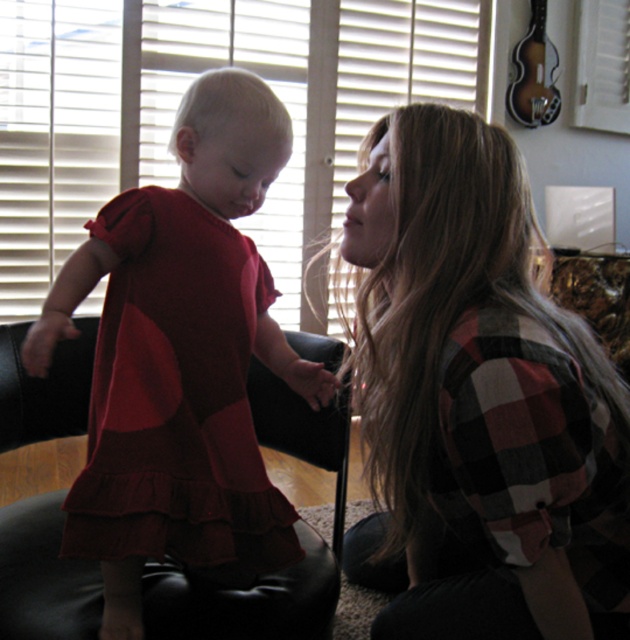
The image size is (630, 640). What do you see at coordinates (476, 401) in the screenshot?
I see `plaid flannel shirt at center` at bounding box center [476, 401].

Which is behind, point (420, 376) or point (135, 365)?

The point (135, 365) is more distant.

The height and width of the screenshot is (640, 630). Identify the location of plaid flannel shirt at center. 476,401.

Between plaid flannel shirt at center and white matte blinds at upper center, which one has less height?

With less height is plaid flannel shirt at center.

Does point (541, 554) lie behind point (37, 236)?

No, it is in front of (37, 236).

This screenshot has height=640, width=630. Describe the element at coordinates (476, 401) in the screenshot. I see `plaid flannel shirt at center` at that location.

This screenshot has width=630, height=640. What are the coordinates of `plaid flannel shirt at center` in the screenshot? It's located at (476, 401).

Who is higher up, matte red dress at left or white matte blinds at upper center?

Positioned higher is white matte blinds at upper center.

Which of these two, matte red dress at left or white matte blinds at upper center, stands taller?

With more height is white matte blinds at upper center.

Which is in front, point (239, 372) or point (321, 150)?

Point (239, 372) is more forward.

You are a GUI agent. You are given a task and a screenshot of the screen. Output one action in this format:
    pyautogui.click(x=<x>, y=<y>)
    Task: Click on the matte red dress at left
    
    Given the screenshot: What is the action you would take?
    [181, 358]